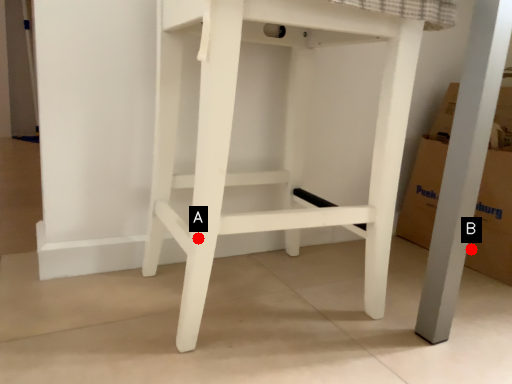
Question: Two points are circled on the image, labeled by A and B beside each circle. Which point is farther from the camera taking this photo?

Choices:
 (A) A is further
 (B) B is further

Answer: (B)